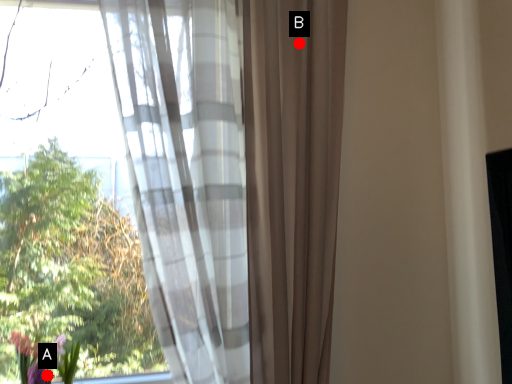
Question: Two points are circled on the image, labeled by A and B beside each circle. Which of the following is the closest to the observer?

Choices:
 (A) A is closer
 (B) B is closer

Answer: (B)